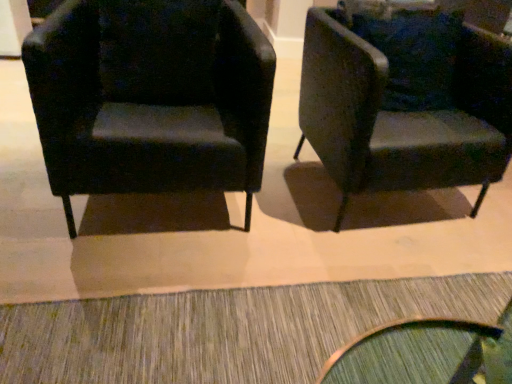
Find the location of `vacant space behind textured gray doormat at lower center`. vacant space behind textured gray doormat at lower center is located at coordinates pos(307,229).